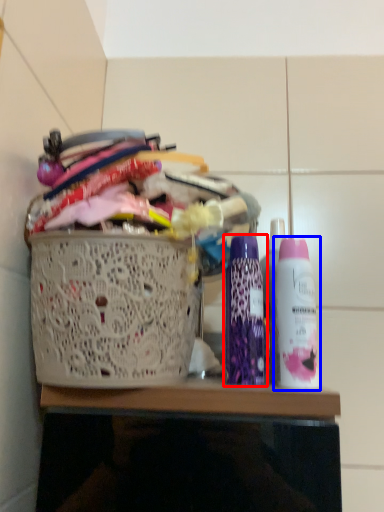
Question: Which point is closer to the camera, bottle (highlighted by a red box) or bottle (highlighted by a blue box)?

Choices:
 (A) bottle
 (B) bottle

Answer: (B)